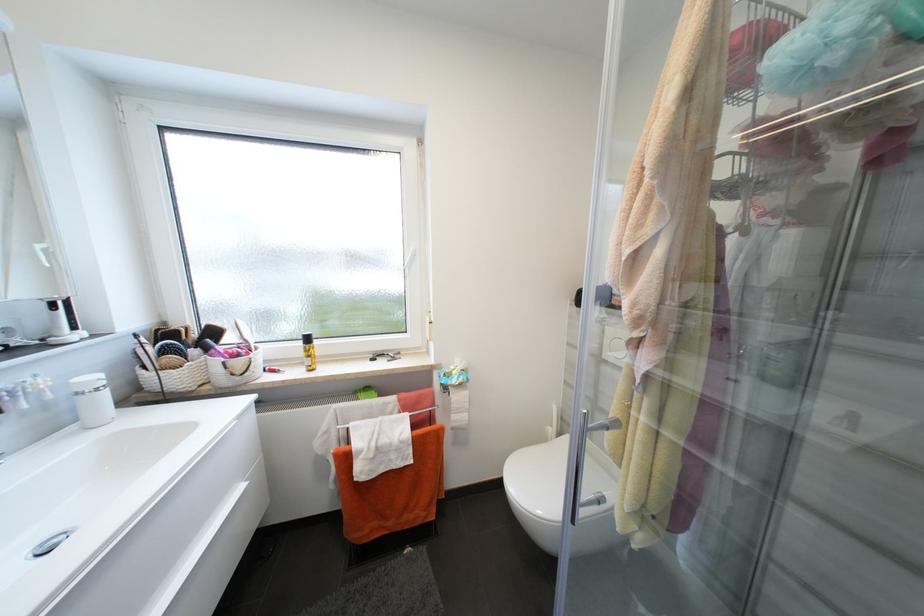
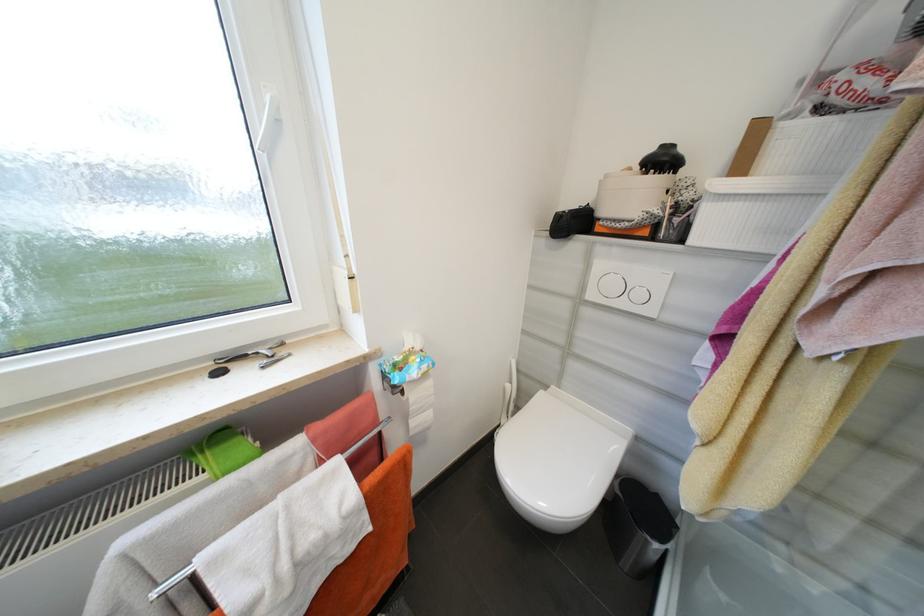
Find the pixel in the second image that matches (x=554, y=430) in the first image.

(514, 387)